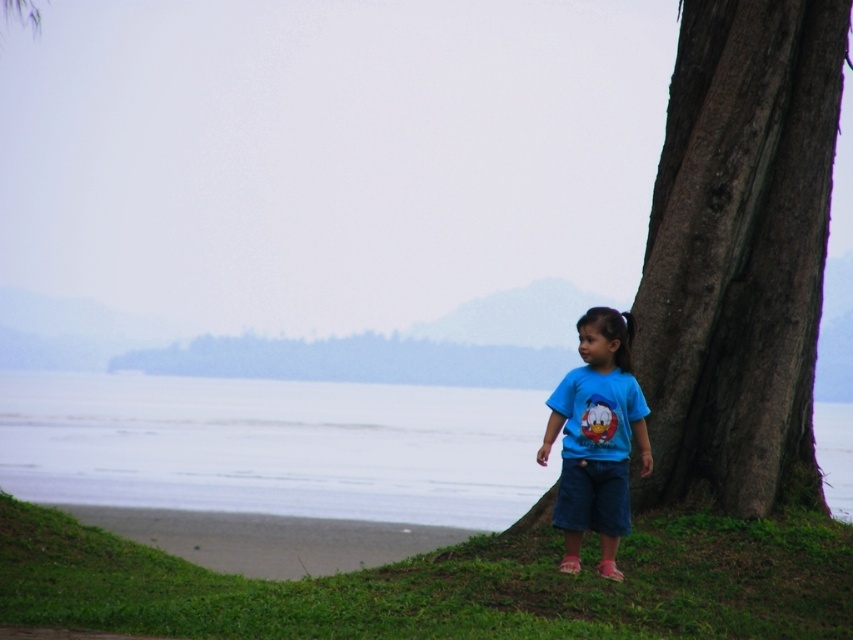
You are a parent watching your child at the beach. You see the smooth water at lower center and the sandy shore at lower left. Which one is closer to the child standing on the grass?

The sandy shore at lower left is closer to the child standing on the grass because the smooth water at lower center is located above it, meaning the sandy shore is between the child and the water.

You are a nature photographer standing at the edge of the grassy area in the scene. You want to take a closeup photo of the dark brown textured bark at right. Where exactly should you position yourself to capture the bark without moving the camera? Please provide coordinates in the format of a point like this example format point 0.397, 0.868.

The dark brown textured bark at right is located at point (740, 253), so you should position yourself at that coordinate to capture it without moving the camera.

You are standing at the edge of the sandy shore at lower left and want to reach the smooth water at lower center. Which direction should you walk to get there?

You should walk to the right to reach the smooth water at lower center since it is located to the right of the sandy shore at lower left.